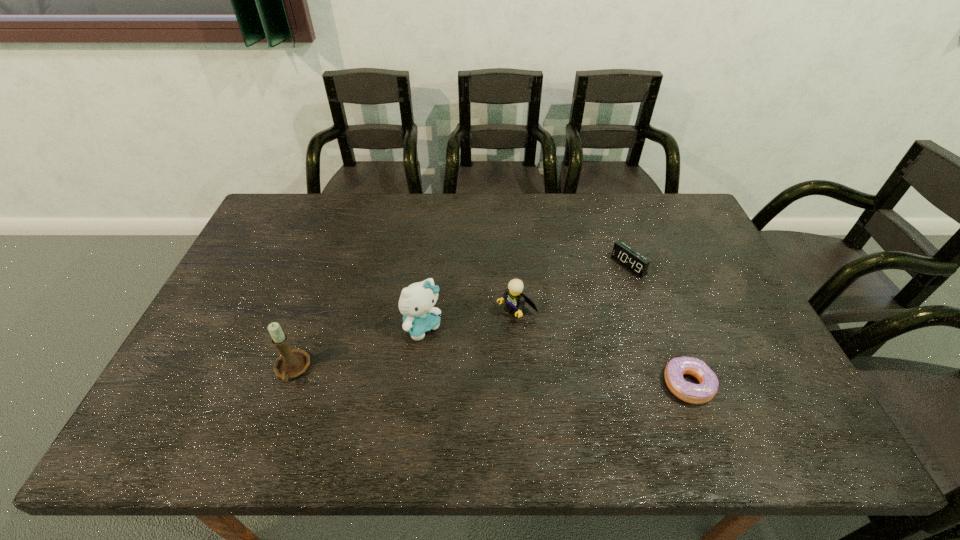
Identify the location of free area in between the leftmost object and the fourth tallest object. (461, 318).

The width and height of the screenshot is (960, 540). What are the coordinates of `blank region between the candle holder and the fourth object from right to left` in the screenshot? It's located at (357, 348).

This screenshot has width=960, height=540. What are the coordinates of `vacant space that's between the doughnut and the farthest object` in the screenshot? It's located at (659, 325).

Identify the location of free space that is in between the second object from left to right and the shortest object. Image resolution: width=960 pixels, height=540 pixels. (555, 355).

You are a GUI agent. You are given a task and a screenshot of the screen. Output one action in this format:
    pyautogui.click(x=<x>, y=<y>)
    Task: Click on the free point between the Lego and the kitten
    The image size is (960, 540).
    Given the screenshot: What is the action you would take?
    pyautogui.click(x=469, y=317)

You are a GUI agent. You are given a task and a screenshot of the screen. Output one action in this format:
    pyautogui.click(x=<x>, y=<y>)
    Task: Click on the third closest object to the farthest object
    This screenshot has height=540, width=960.
    Given the screenshot: What is the action you would take?
    [416, 302]

Locate an element on the screen. Image resolution: width=960 pixels, height=540 pixels. object identified as the second closest to the candle holder is located at coordinates (515, 300).

You are a GUI agent. You are given a task and a screenshot of the screen. Output one action in this format:
    pyautogui.click(x=<x>, y=<y>)
    Task: Click on the free space in the image that satisfies the following two spatial constraints: 1. on the side of the shortest object with the handle; 2. on the left side of the candle holder
    This screenshot has width=960, height=540.
    Given the screenshot: What is the action you would take?
    pyautogui.click(x=287, y=384)

Locate an element on the screen. This screenshot has width=960, height=540. free location that satisfies the following two spatial constraints: 1. on the side of the shortest object with the handle; 2. on the right side of the candle holder is located at coordinates (287, 384).

The width and height of the screenshot is (960, 540). Identify the location of free space in the image that satisfies the following two spatial constraints: 1. on the front side of the alarm clock; 2. on the left side of the doughnut. (670, 384).